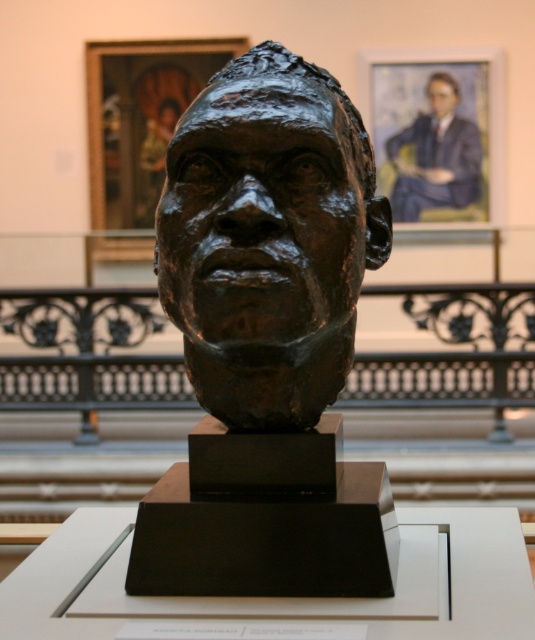
You are an art student standing in front of the museum display. You notice the bronze head at center and the matte bronze bust at upper center. Which object is positioned to the right side of the other?

The bronze head at center is to the left of the matte bronze bust at upper center, so the matte bronze bust at upper center is positioned to the right side of the bronze head at center.

You are an art curator planning to rearrange the display. You need to place a new sculpture that requires more space between the blue suit at upper right and the matte bronze bust at upper center. Based on their sizes, which object should you move further away to create more space?

The blue suit at upper right is larger than the matte bronze bust at upper center, so you should move the blue suit at upper right further away to create more space between them.

In the scene shown: You are a museum curator planning to install a new lighting system. You need to ensure that the bronze head at center and the blue suit at upper right are both adequately lit. Given their sizes, which object requires a larger light fixture to cover its entire surface?

The blue suit at upper right requires a larger light fixture because it is bigger than the bronze head at center.